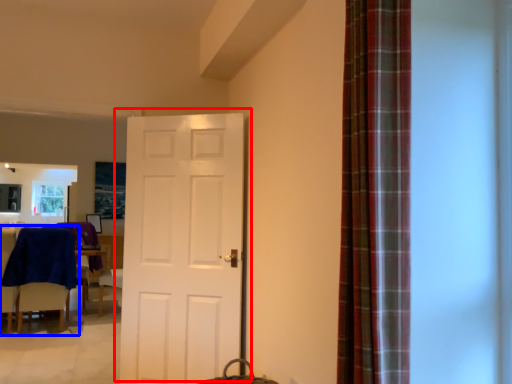
Question: Which point is closer to the camera, door (highlighted by a red box) or chair (highlighted by a blue box)?

Choices:
 (A) door
 (B) chair

Answer: (A)